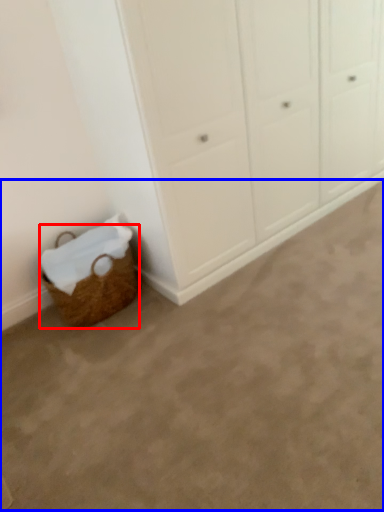
Question: Which point is further to the camera, basket (highlighted by a red box) or plain (highlighted by a blue box)?

Choices:
 (A) basket
 (B) plain

Answer: (A)